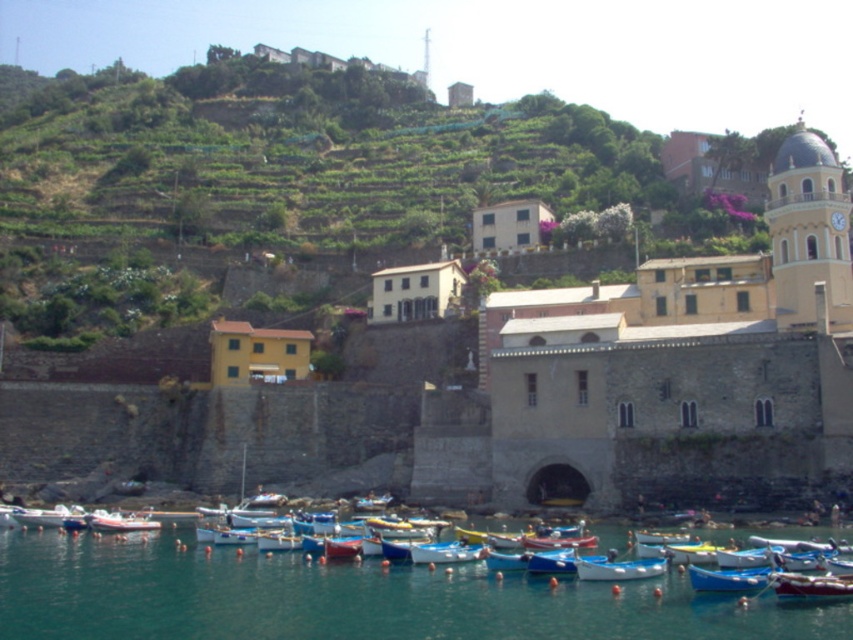
Is wooden boat at lower right above blue glossy boat at lower left?

Indeed, wooden boat at lower right is positioned over blue glossy boat at lower left.

Is wooden boat at lower right closer to camera compared to blue glossy boat at lower left?

Yes, wooden boat at lower right is closer to the viewer.

Does point (770, 579) lie in front of point (83, 515)?

Yes.

The width and height of the screenshot is (853, 640). Find the location of `wooden boat at lower right`. wooden boat at lower right is located at coordinates (811, 586).

Does blue painted wooden boat at lower center appear on the left side of blue glossy boat at lower left?

Incorrect, blue painted wooden boat at lower center is not on the left side of blue glossy boat at lower left.

Is blue painted wooden boat at lower center closer to camera compared to blue glossy boat at lower left?

Yes, it is.

The image size is (853, 640). Find the location of `blue painted wooden boat at lower center`. blue painted wooden boat at lower center is located at coordinates (619, 570).

Locate an element on the screen. The width and height of the screenshot is (853, 640). blue painted wooden boat at lower center is located at coordinates (619, 570).

Measure the distance between blue glossy boat at center and blue glossy boat at lower left.

They are 26.23 meters apart.

Does blue glossy boat at center appear over blue glossy boat at lower left?

Yes.

Does point (454, 548) lie in front of point (25, 508)?

That is True.

Locate an element on the screen. blue glossy boat at center is located at coordinates (445, 552).